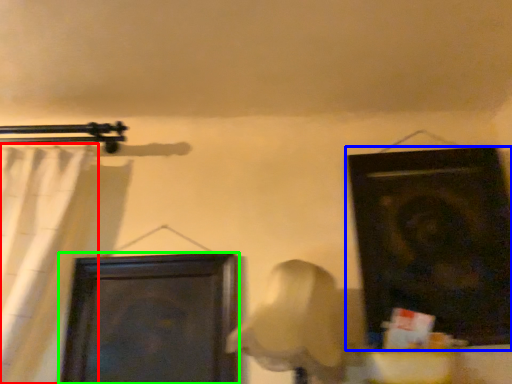
Question: Based on their relative distances, which object is farther from curtain (highlighted by a red box)? Choose from door (highlighted by a blue box) and door (highlighted by a green box).

Choices:
 (A) door
 (B) door

Answer: (A)